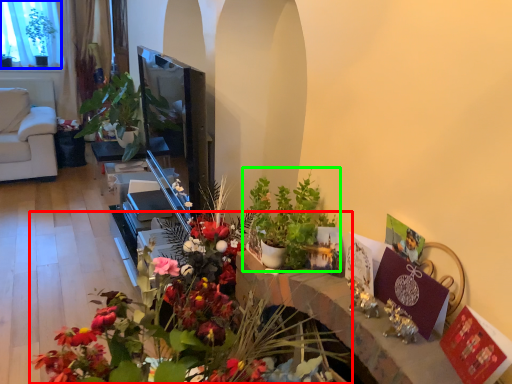
Question: Estimate the real-world distances between objects in this image. Which object is closer to flower (highlighted by a red box), window screen (highlighted by a blue box) or houseplant (highlighted by a green box)?

Choices:
 (A) window screen
 (B) houseplant

Answer: (B)